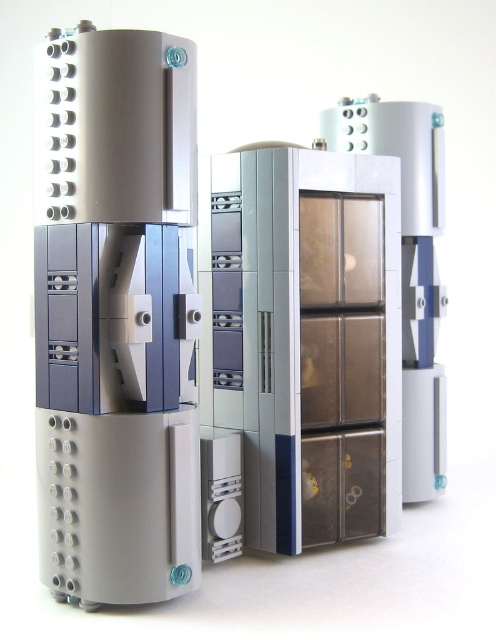
You are an architect designing a futuristic office space. You have to place the matte gray tower at left and the translucent plastic file cabinet at center in a way that follows the spatial arrangement shown in the image. Which object should be placed higher up to maintain the correct spatial relationship?

The matte gray tower at left should be placed higher up than the translucent plastic file cabinet at center because it is positioned over it in the image.

You are a drone operator trying to navigate a drone between two points in the LEGO structure. The points are labeled as point (x=128, y=209) and point (x=427, y=204). Based on the structure, which point is closer to the camera?

Point (x=128, y=209) is closer to the camera than point (x=427, y=204).

You are a technician needing to inspect the matte gray tower at left. Your tools require you to be within 1.5 meters to operate effectively. Can you use your tools from your current position?

The matte gray tower at left is 1.37 meters away from the camera, which is within the 1.5 meters required for your tools to operate effectively. Therefore, you can use your tools from your current position.